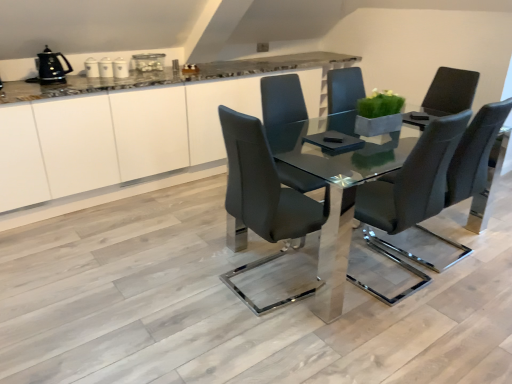
At what (x,y) coordinates should I click in order to perform the action: click on blank area beneath matte black chair at center, which ranks as the 2th chair in right-to-left order (from a real-world perspective). Please return your answer as a coordinate pair (x, y). The height and width of the screenshot is (384, 512). Looking at the image, I should click on (255, 288).